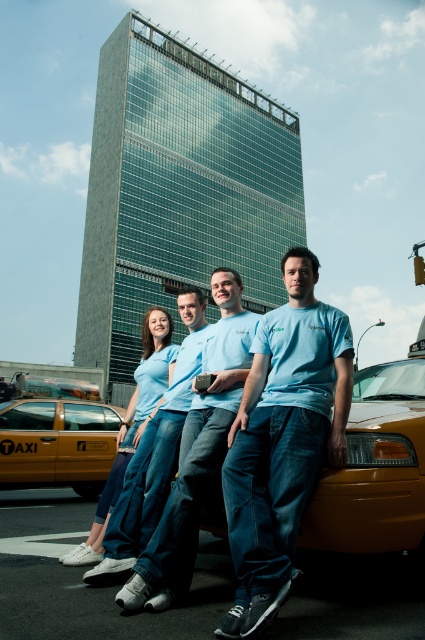
You are standing in front of the modern building and want to take a photo of the two points marked in the image. Which point is closer to you, point (2, 451) or point (170, 348)?

Point (170, 348) is closer to you because it is less further to the camera than point (2, 451).